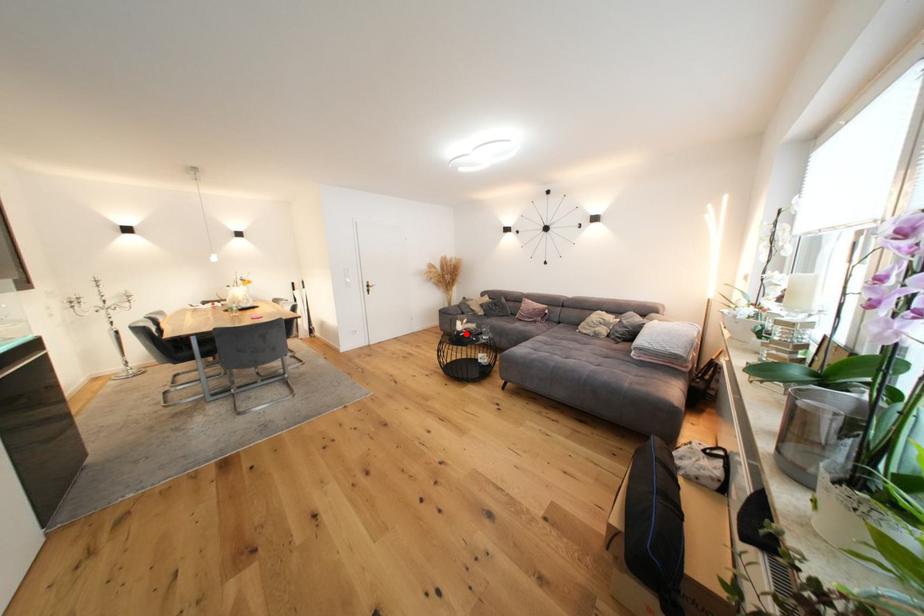
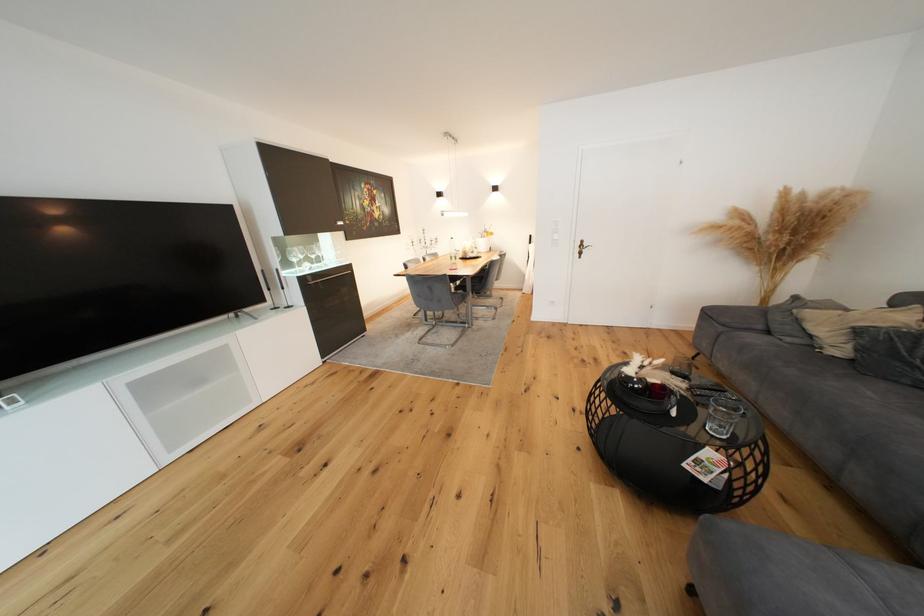
Question: A red point is marked in image1. In image2, is the corresponding 3D point closer to the camera or farther? Reply with the corresponding letter.

Choices:
 (A) The corresponding 3D point is closer.
 (B) The corresponding 3D point is farther.

Answer: (A)